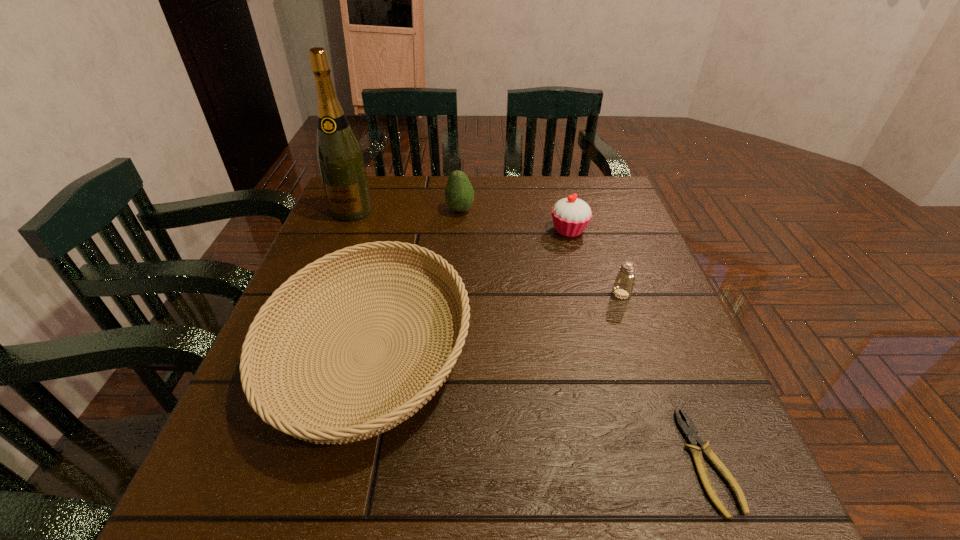
Locate an element on the screen. pliers at the right edge is located at coordinates (691, 434).

Where is `object located in the far left corner section of the desktop`? object located in the far left corner section of the desktop is located at coordinates (339, 156).

The height and width of the screenshot is (540, 960). Find the location of `object present at the far right corner`. object present at the far right corner is located at coordinates (571, 215).

Image resolution: width=960 pixels, height=540 pixels. Find the location of `object at the near right corner`. object at the near right corner is located at coordinates (691, 434).

This screenshot has width=960, height=540. What are the coordinates of `vacant space at the far edge of the desktop` in the screenshot? It's located at (471, 180).

Identify the location of blank space at the left edge of the desktop. This screenshot has height=540, width=960. 322,233.

The image size is (960, 540). In the image, there is a desktop. In order to click on free space at the right edge in this screenshot , I will do `click(641, 285)`.

In the image, there is a desktop. Where is `vacant space at the far left corner`? Image resolution: width=960 pixels, height=540 pixels. vacant space at the far left corner is located at coordinates (386, 183).

Identify the location of vacant space at the near left corner of the desktop. This screenshot has width=960, height=540. (271, 510).

This screenshot has height=540, width=960. In the image, there is a desktop. In order to click on vacant space at the far right corner in this screenshot , I will do `click(588, 178)`.